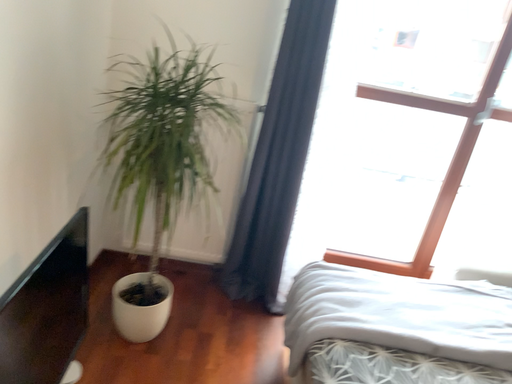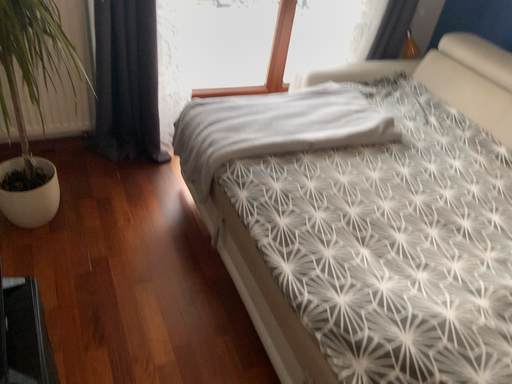
Question: How did the camera likely rotate when shooting the video?

Choices:
 (A) rotated downward
 (B) rotated upward

Answer: (A)